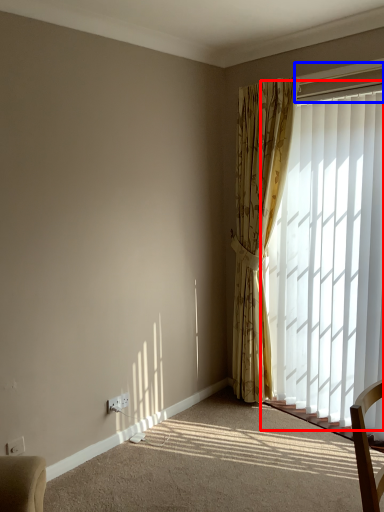
Question: Which object appears closest to the camera in this image, window (highlighted by a red box) or window frame (highlighted by a blue box)?

Choices:
 (A) window
 (B) window frame

Answer: (A)